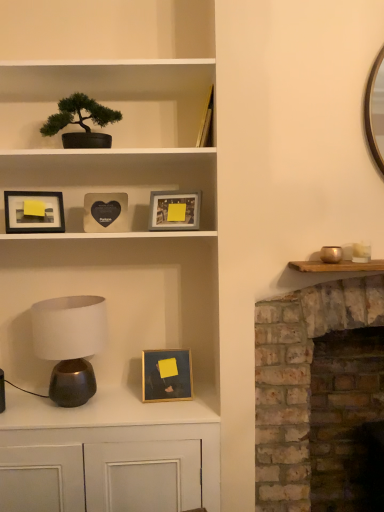
Question: Is point (48, 118) closer or farther from the camera than point (187, 138)?

Choices:
 (A) closer
 (B) farther

Answer: (A)

Question: Is green matte bonsai tree at upper left inside the boundaries of matte black bonsai tree at upper left, or outside?

Choices:
 (A) outside
 (B) inside

Answer: (B)

Question: Estimate the real-world distances between objects in this image. Which object is farther from the gold metallic bowl at right?

Choices:
 (A) brick fireplace at right
 (B) matte black cabinet at center
 (C) matte gray picture frame at upper center, the first picture frame in the right-to-left sequence
 (D) black matte heart-shaped object at upper center, the 4th picture frame positioned from the bottom
 (E) gold/glossy picture frame at center, the 2th picture frame positioned from the right

Answer: (B)

Question: Based on their relative distances, which object is farther from the gold/glossy picture frame at center, which appears as the third picture frame when viewed from the left?

Choices:
 (A) matte black bonsai tree at upper left
 (B) brick fireplace at right
 (C) matte black frame at upper left, placed as the 4th picture frame when sorted from right to left
 (D) black matte heart-shaped object at upper center, the second picture frame when ordered from left to right
 (E) satin white lampshade at lower left

Answer: (A)